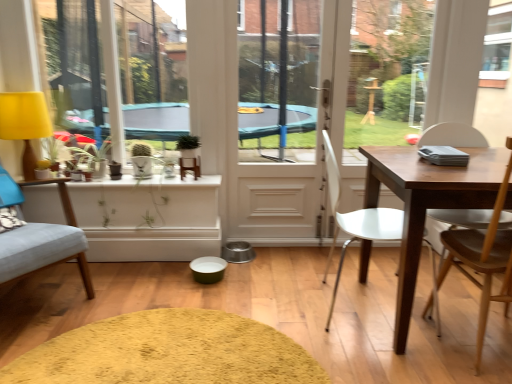
What is the approximate height of white plastic chair at center, the 2th chair when ordered from right to left?

white plastic chair at center, the 2th chair when ordered from right to left, is 91.23 centimeters in height.

The height and width of the screenshot is (384, 512). Find the location of `white plastic chair at center, the 2th chair when ordered from right to left`. white plastic chair at center, the 2th chair when ordered from right to left is located at coordinates (355, 221).

Describe the element at coordinates (119, 68) in the screenshot. I see `yellow fabric at left` at that location.

Describe the element at coordinates (25, 124) in the screenshot. I see `yellow fabric lampshade at left` at that location.

Measure the distance between point (137, 323) and camera.

They are 6.30 feet apart.

Identify the location of soft yellow rug at center. Image resolution: width=512 pixels, height=384 pixels. (168, 352).

Find the location of a particular element. Image resolution: width=512 pixels, height=384 pixels. light blue fabric chair at left, which ranks as the third chair in right-to-left order is located at coordinates (44, 244).

I want to click on white glossy screen door at center, so click(x=280, y=120).

Image resolution: width=512 pixels, height=384 pixels. What do you see at coordinates (483, 257) in the screenshot?
I see `wooden chair at right, arranged as the 3th chair when viewed from the left` at bounding box center [483, 257].

I want to click on white plastic chair at center, positioned as the second chair in left-to-right order, so click(355, 221).

In terms of width, does white glossy screen door at center look wider or thinner when compared to wooden chair at right, the 1th chair positioned from the right?

white glossy screen door at center is thinner than wooden chair at right, the 1th chair positioned from the right.

Consider the image. Is white glossy screen door at center far from wooden chair at right, the 1th chair positioned from the right?

Yes, white glossy screen door at center and wooden chair at right, the 1th chair positioned from the right, are quite far apart.

Locate an element on the screen. The height and width of the screenshot is (384, 512). the 3rd chair in front of the white glossy screen door at center, starting your count from the anchor is located at coordinates (483, 257).

From a real-world perspective, who is located higher, white glossy screen door at center or wooden chair at right, the 1th chair positioned from the right?

In real-world perspective, white glossy screen door at center is above.

From the image's perspective, which object appears higher, wooden chair at right, arranged as the 3th chair when viewed from the left, or yellow fabric lampshade at left?

yellow fabric lampshade at left appears higher in the image.

From the picture: Which object is positioned more to the right, wooden chair at right, the 1th chair positioned from the right, or yellow fabric lampshade at left?

wooden chair at right, the 1th chair positioned from the right, is more to the right.

Which object is further away from the camera, wooden chair at right, arranged as the 3th chair when viewed from the left, or yellow fabric lampshade at left?

yellow fabric lampshade at left is more distant.

How different are the orientations of wooden chair at right, the 1th chair positioned from the right, and yellow fabric lampshade at left in degrees?

The angular difference between wooden chair at right, the 1th chair positioned from the right, and yellow fabric lampshade at left is 177 degrees.

From the image's perspective, would you say yellow fabric at left is shown under white plastic chair at center, positioned as the second chair in left-to-right order?

Incorrect, from the image's perspective, yellow fabric at left is higher than white plastic chair at center, positioned as the second chair in left-to-right order.

In the scene shown: Could you tell me if yellow fabric at left is facing white plastic chair at center, the 2th chair when ordered from right to left?

No, yellow fabric at left is not aimed at white plastic chair at center, the 2th chair when ordered from right to left.

Considering the sizes of yellow fabric at left and white plastic chair at center, the 2th chair when ordered from right to left, in the image, is yellow fabric at left bigger or smaller than white plastic chair at center, the 2th chair when ordered from right to left,?

Clearly, yellow fabric at left is larger in size than white plastic chair at center, the 2th chair when ordered from right to left.

What's the angular difference between yellow fabric at left and white plastic chair at center, positioned as the second chair in left-to-right order,'s facing directions?

The angle between the facing direction of yellow fabric at left and the facing direction of white plastic chair at center, positioned as the second chair in left-to-right order, is 88.5 degrees.

Can you tell me how much yellow fabric lampshade at left and soft yellow rug at center differ in facing direction?

They differ by 0.66 degrees in their facing directions.

In terms of size, does yellow fabric lampshade at left appear bigger or smaller than soft yellow rug at center?

yellow fabric lampshade at left is bigger than soft yellow rug at center.

Considering the relative positions of yellow fabric lampshade at left and soft yellow rug at center in the image provided, is yellow fabric lampshade at left to the left or to the right of soft yellow rug at center?

Clearly, yellow fabric lampshade at left is on the left of soft yellow rug at center in the image.

Considering the points (16, 134) and (271, 356), which point is behind, point (16, 134) or point (271, 356)?

The point (16, 134) is farther.

Can you confirm if soft yellow rug at center is positioned to the right of light blue fabric chair at left, the 1th chair in the left-to-right sequence?

Indeed, soft yellow rug at center is positioned on the right side of light blue fabric chair at left, the 1th chair in the left-to-right sequence.

Considering the sizes of objects soft yellow rug at center and light blue fabric chair at left, which ranks as the third chair in right-to-left order, in the image provided, who is thinner, soft yellow rug at center or light blue fabric chair at left, which ranks as the third chair in right-to-left order,?

Thinner between the two is soft yellow rug at center.

At what (x,y) coordinates should I click in order to perform the action: click on wide on the right of the light blue fabric chair at left, which ranks as the third chair in right-to-left order. Please return your answer as a coordinate pair (x, y). The width and height of the screenshot is (512, 384). Looking at the image, I should click on (168, 352).

Is soft yellow rug at center placed right next to light blue fabric chair at left, which ranks as the third chair in right-to-left order?

No, soft yellow rug at center is not in contact with light blue fabric chair at left, which ranks as the third chair in right-to-left order.

Considering the relative sizes of white plastic chair at center, the 2th chair when ordered from right to left, and light blue fabric chair at left, the 1th chair in the left-to-right sequence, in the image provided, is white plastic chair at center, the 2th chair when ordered from right to left, bigger than light blue fabric chair at left, the 1th chair in the left-to-right sequence,?

No, white plastic chair at center, the 2th chair when ordered from right to left, is not bigger than light blue fabric chair at left, the 1th chair in the left-to-right sequence.

How different are the orientations of white plastic chair at center, positioned as the second chair in left-to-right order, and light blue fabric chair at left, the 1th chair in the left-to-right sequence, in degrees?

The angle between the facing direction of white plastic chair at center, positioned as the second chair in left-to-right order, and the facing direction of light blue fabric chair at left, the 1th chair in the left-to-right sequence, is 34.4 degrees.

Considering the positions of point (433, 264) and point (0, 252), is point (433, 264) closer or farther from the camera than point (0, 252)?

Point (433, 264) appears to be farther away from the viewer than point (0, 252).

From a real-world perspective, does light blue fabric chair at left, the 1th chair in the left-to-right sequence, stand above yellow fabric at left?

No, from a real-world perspective, light blue fabric chair at left, the 1th chair in the left-to-right sequence, is not on top of yellow fabric at left.

You are a GUI agent. You are given a task and a screenshot of the screen. Output one action in this format:
    pyautogui.click(x=<x>, y=<y>)
    Task: Click on the 2nd chair positioned below the yellow fabric at left (from the image's perspective)
    
    Given the screenshot: What is the action you would take?
    pyautogui.click(x=44, y=244)

Does light blue fabric chair at left, which ranks as the third chair in right-to-left order, lie in front of yellow fabric at left?

Yes, light blue fabric chair at left, which ranks as the third chair in right-to-left order, is in front of yellow fabric at left.

Considering the sizes of objects light blue fabric chair at left, which ranks as the third chair in right-to-left order, and yellow fabric at left in the image provided, who is thinner, light blue fabric chair at left, which ranks as the third chair in right-to-left order, or yellow fabric at left?

With smaller width is yellow fabric at left.

Locate an element on the screen. chair that is the 2nd one when counting rightward from the white glossy screen door at center is located at coordinates (483, 257).

Locate an element on the screen. the 3rd chair in front when counting from the yellow fabric lampshade at left is located at coordinates (483, 257).

Which object lies nearer to the anchor point white plastic chair at center, the 2th chair when ordered from right to left, light blue fabric chair at left, which ranks as the third chair in right-to-left order, or white glossy screen door at center?

Based on the image, white glossy screen door at center appears to be nearer to white plastic chair at center, the 2th chair when ordered from right to left.

Considering their positions, is white glossy screen door at center positioned further to wooden chair at right, the 1th chair positioned from the right, than yellow fabric at left?

yellow fabric at left is positioned further to the anchor wooden chair at right, the 1th chair positioned from the right.

When comparing their distances from yellow fabric lampshade at left, does light blue fabric chair at left, which ranks as the third chair in right-to-left order, or yellow fabric at left seem closer?

Among the two, light blue fabric chair at left, which ranks as the third chair in right-to-left order, is located nearer to yellow fabric lampshade at left.

When comparing their distances from white glossy screen door at center, does soft yellow rug at center or white plastic chair at center, positioned as the second chair in left-to-right order, seem further?

soft yellow rug at center lies further to white glossy screen door at center than the other object.

Considering their positions, is wooden chair at right, arranged as the 3th chair when viewed from the left, positioned further to green matte plant at upper center than soft yellow rug at center?

Among the two, wooden chair at right, arranged as the 3th chair when viewed from the left, is located further to green matte plant at upper center.

Which object lies further to the anchor point white plastic chair at center, positioned as the second chair in left-to-right order, white glossy screen door at center or yellow fabric at left?

yellow fabric at left lies further to white plastic chair at center, positioned as the second chair in left-to-right order, than the other object.

Looking at the image, which one is located closer to light blue fabric chair at left, which ranks as the third chair in right-to-left order, wooden chair at right, arranged as the 3th chair when viewed from the left, or white plastic chair at center, the 2th chair when ordered from right to left?

white plastic chair at center, the 2th chair when ordered from right to left.

Based on the photo, which object lies further to the anchor point white glossy screen door at center, light blue fabric chair at left, which ranks as the third chair in right-to-left order, or yellow fabric lampshade at left?

The object further to white glossy screen door at center is yellow fabric lampshade at left.

Locate an element on the screen. The height and width of the screenshot is (384, 512). chair between green matte plant at upper center and wooden chair at right, the 1th chair positioned from the right, from left to right is located at coordinates (355, 221).

Identify the location of wide between yellow fabric lampshade at left and wooden chair at right, the 1th chair positioned from the right, in the horizontal direction. The image size is (512, 384). (168, 352).

Find the location of a particular element. Image resolution: width=512 pixels, height=384 pixels. screen door situated between yellow fabric lampshade at left and white plastic chair at center, the 2th chair when ordered from right to left, from left to right is located at coordinates (280, 120).

The height and width of the screenshot is (384, 512). I want to click on window screen between yellow fabric lampshade at left and white plastic chair at center, the 2th chair when ordered from right to left, so click(119, 68).